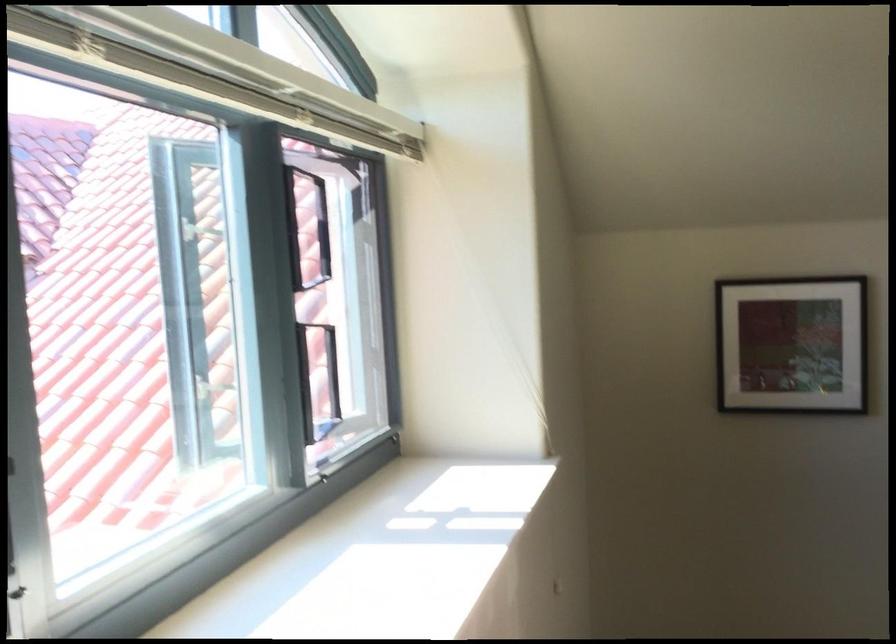
This screenshot has width=896, height=644. What do you see at coordinates (483, 298) in the screenshot? I see `the window blind cord` at bounding box center [483, 298].